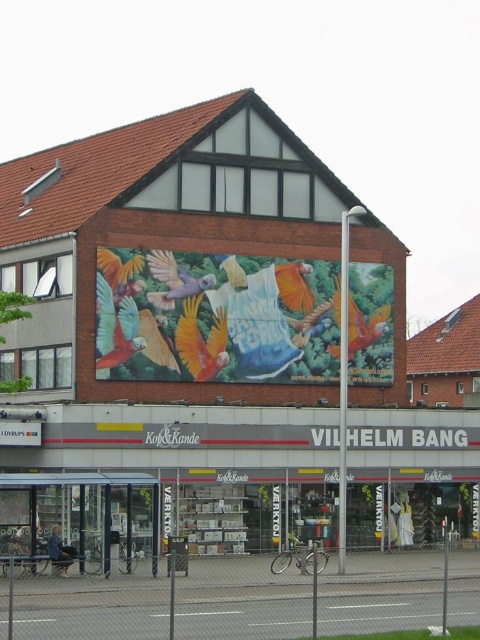
Question: Is vibrant painted mural at center below transparent glass bus stop at lower left?

Choices:
 (A) yes
 (B) no

Answer: (B)

Question: Is vibrant painted mural at center closer to the viewer compared to transparent glass bus stop at lower left?

Choices:
 (A) no
 (B) yes

Answer: (A)

Question: Among these points, which one is farthest from the camera?

Choices:
 (A) (308, 372)
 (B) (135, 515)

Answer: (A)

Question: Does vibrant painted mural at center have a lesser width compared to transparent glass bus stop at lower left?

Choices:
 (A) yes
 (B) no

Answer: (B)

Question: Among these objects, which one is farthest from the camera?

Choices:
 (A) transparent glass bus stop at lower left
 (B) vibrant painted mural at center

Answer: (B)